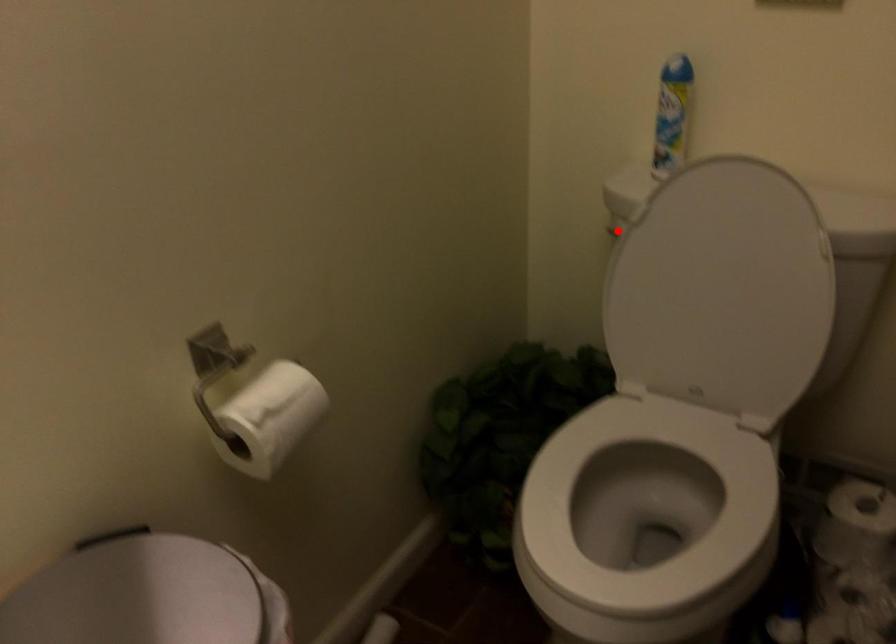
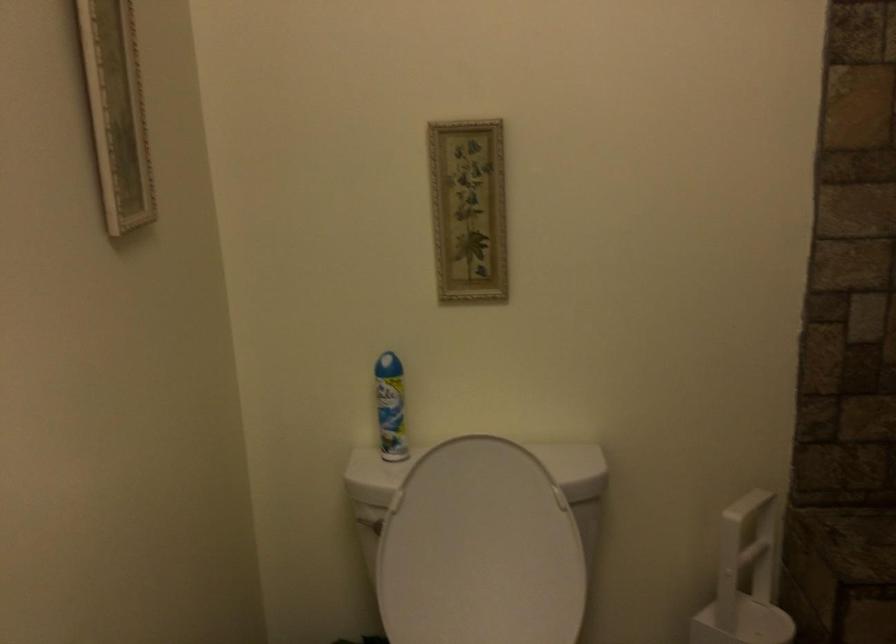
Locate, in the second image, the point that corresponds to the highlighted location in the first image.

(368, 522)